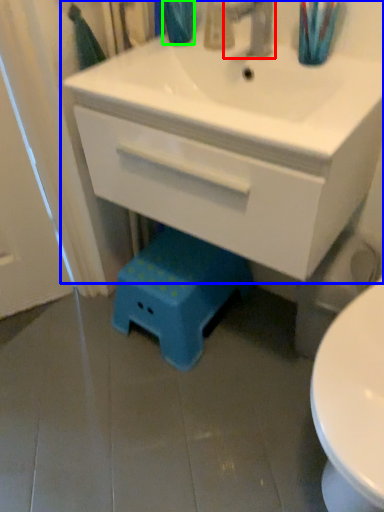
Question: Based on their relative distances, which object is farther from tap (highlighted by a red box)? Choose from bathroom cabinet (highlighted by a blue box) and teal (highlighted by a green box).

Choices:
 (A) bathroom cabinet
 (B) teal

Answer: (A)